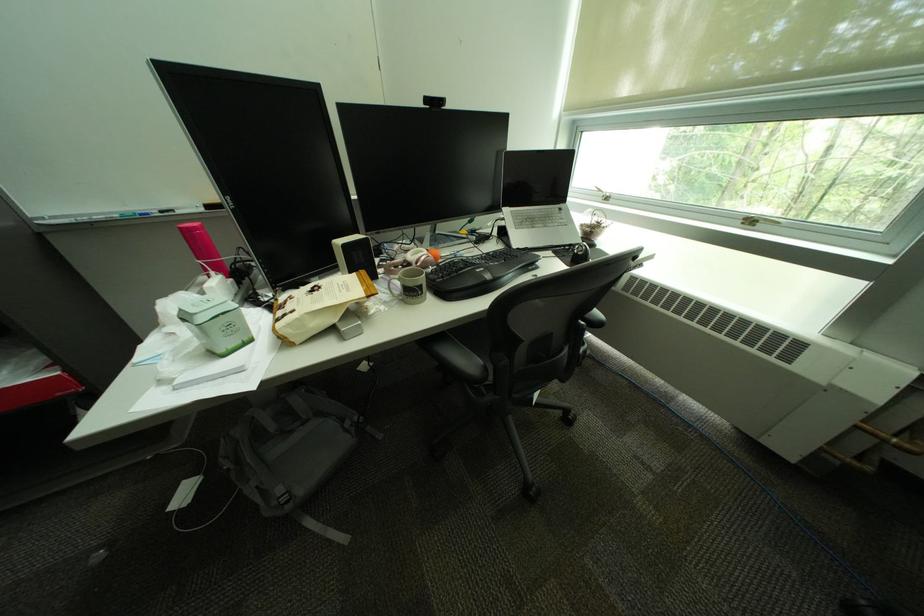
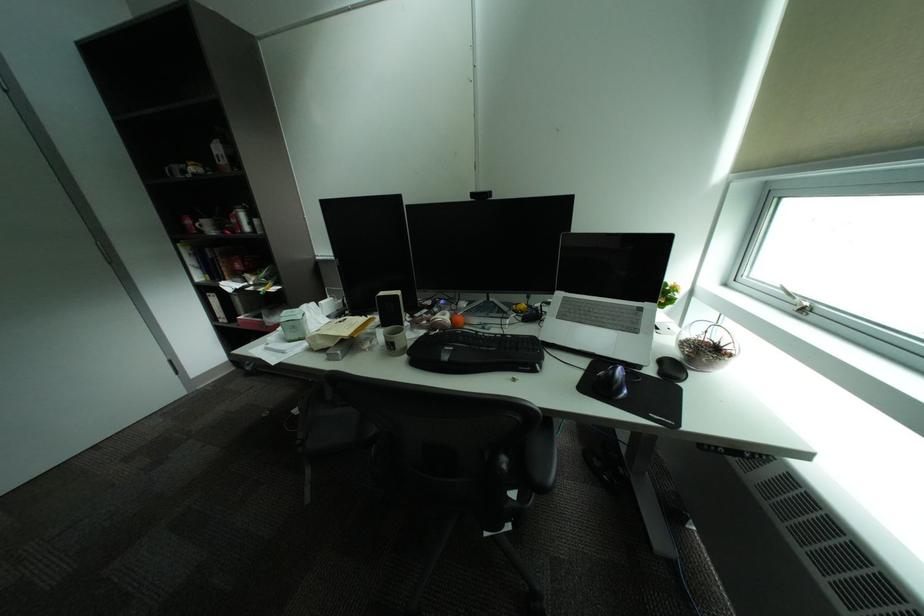
Where in the second image is the point corresponding to pixel 431 294 from the first image?

(403, 349)